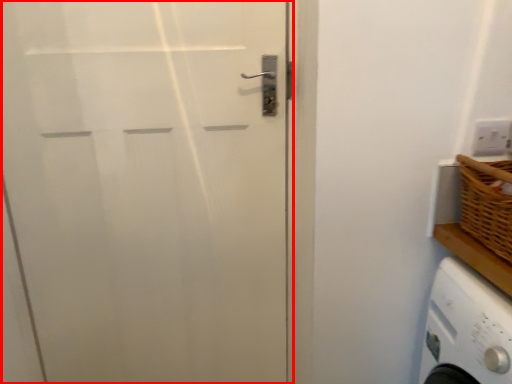
Question: From the image's perspective, where is door (annotated by the red box) located in relation to electric outlet in the image?

Choices:
 (A) below
 (B) above

Answer: (A)